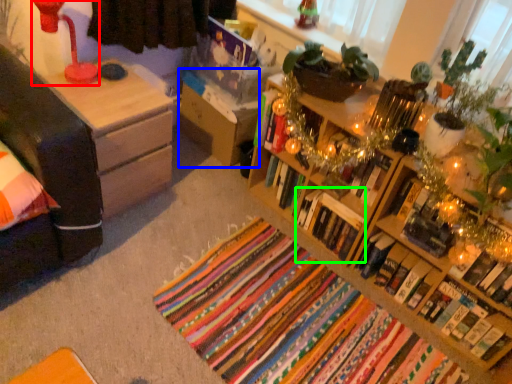
Question: Which object is positioned closest to lamp (highlighted by a red box)? Select from nightstand (highlighted by a blue box) and book (highlighted by a green box).

Choices:
 (A) nightstand
 (B) book

Answer: (A)